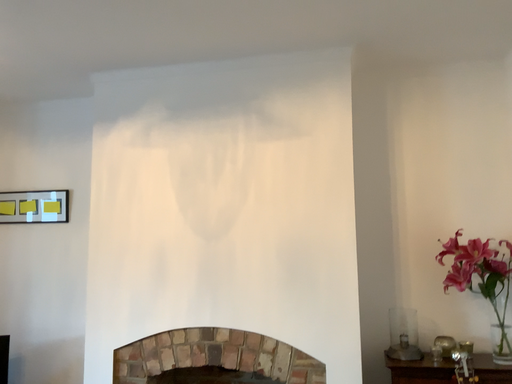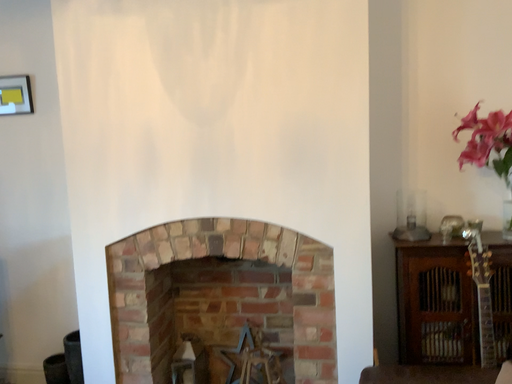
Question: Which way did the camera rotate in the video?

Choices:
 (A) rotated upward
 (B) rotated downward

Answer: (B)